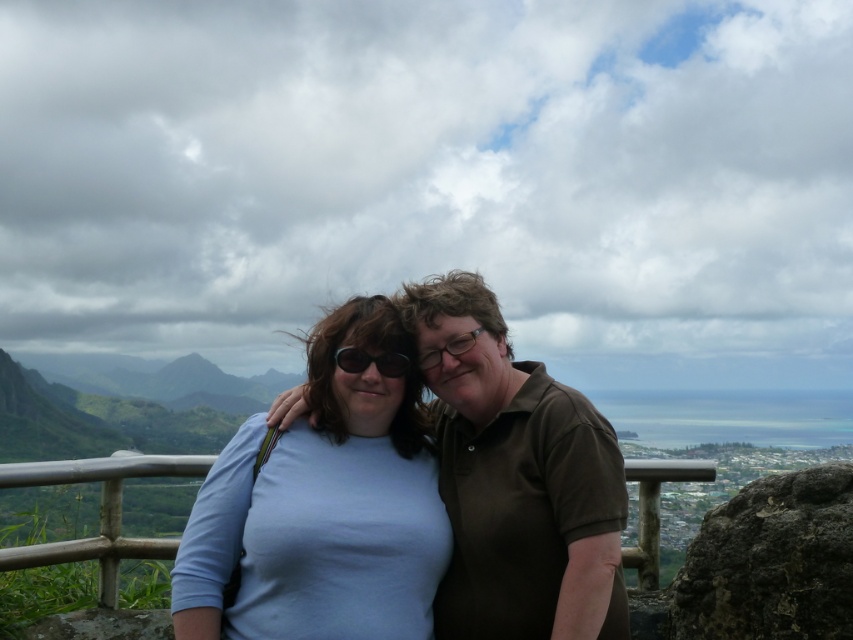
Is brown matte shirt at center shorter than silver metallic rail at center?

Correct, brown matte shirt at center is not as tall as silver metallic rail at center.

From the picture: Is brown matte shirt at center to the right of silver metallic rail at center from the viewer's perspective?

No, brown matte shirt at center is not to the right of silver metallic rail at center.

Between point (621, 621) and point (639, 545), which one is positioned in front?

Point (621, 621) is in front.

Find the location of `brown matte shirt at center`. brown matte shirt at center is located at coordinates click(x=515, y=481).

Who is positioned more to the right, brown matte shirt at center or sunglasses at center?

brown matte shirt at center

Image resolution: width=853 pixels, height=640 pixels. What do you see at coordinates (515, 481) in the screenshot? I see `brown matte shirt at center` at bounding box center [515, 481].

You are a GUI agent. You are given a task and a screenshot of the screen. Output one action in this format:
    pyautogui.click(x=<x>, y=<y>)
    Task: Click on the brown matte shirt at center
    This screenshot has width=853, height=640.
    Given the screenshot: What is the action you would take?
    pyautogui.click(x=515, y=481)

Is light blue fabric at center to the left of brown matte shirt at center from the viewer's perspective?

Correct, you'll find light blue fabric at center to the left of brown matte shirt at center.

The image size is (853, 640). Describe the element at coordinates (323, 508) in the screenshot. I see `light blue fabric at center` at that location.

This screenshot has height=640, width=853. Find the location of `light blue fabric at center`. light blue fabric at center is located at coordinates point(323,508).